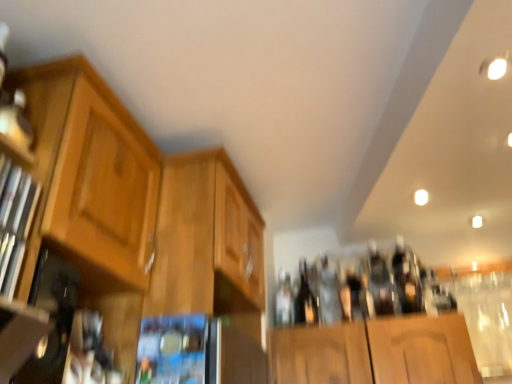
Question: Considering the relative sizes of metallic silver microwave at center and clear glass bottle at center, which is the first bottle from right to left, in the image provided, is metallic silver microwave at center thinner than clear glass bottle at center, which is the first bottle from right to left,?

Choices:
 (A) no
 (B) yes

Answer: (B)

Question: Considering the relative sizes of metallic silver microwave at center and clear glass bottle at center, the second bottle in the left-to-right sequence, in the image provided, is metallic silver microwave at center bigger than clear glass bottle at center, the second bottle in the left-to-right sequence,?

Choices:
 (A) yes
 (B) no

Answer: (A)

Question: From the image's perspective, is metallic silver microwave at center on top of clear glass bottle at center, the second bottle in the left-to-right sequence?

Choices:
 (A) no
 (B) yes

Answer: (A)

Question: Is metallic silver microwave at center wider than clear glass bottle at center, the second bottle in the left-to-right sequence?

Choices:
 (A) yes
 (B) no

Answer: (B)

Question: Considering the relative sizes of metallic silver microwave at center and clear glass bottle at center, the second bottle in the left-to-right sequence, in the image provided, is metallic silver microwave at center shorter than clear glass bottle at center, the second bottle in the left-to-right sequence,?

Choices:
 (A) no
 (B) yes

Answer: (B)

Question: Is metallic silver microwave at center next to clear glass bottle at center, which is the first bottle from right to left?

Choices:
 (A) no
 (B) yes

Answer: (A)

Question: Are wooden cabinet at left and metallic silver microwave at center making contact?

Choices:
 (A) no
 (B) yes

Answer: (A)

Question: From a real-world perspective, is wooden cabinet at left physically above metallic silver microwave at center?

Choices:
 (A) yes
 (B) no

Answer: (A)

Question: From the image's perspective, is wooden cabinet at left over metallic silver microwave at center?

Choices:
 (A) no
 (B) yes

Answer: (B)

Question: Is wooden cabinet at left oriented away from metallic silver microwave at center?

Choices:
 (A) yes
 (B) no

Answer: (B)

Question: From a real-world perspective, is wooden cabinet at left beneath metallic silver microwave at center?

Choices:
 (A) no
 (B) yes

Answer: (A)

Question: Is wooden cabinet at left outside metallic silver microwave at center?

Choices:
 (A) no
 (B) yes

Answer: (B)

Question: Can you confirm if black glass beer bottle at center is thinner than wooden cabinet at center, which ranks as the second cabinetry in left-to-right order?

Choices:
 (A) yes
 (B) no

Answer: (A)